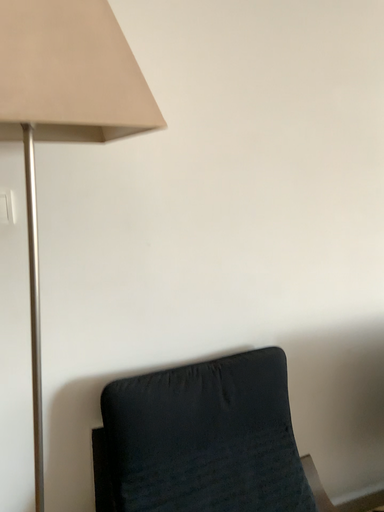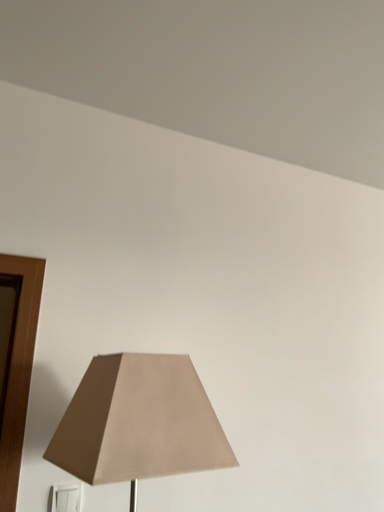
Question: How did the camera likely rotate when shooting the video?

Choices:
 (A) rotated upward
 (B) rotated downward

Answer: (A)